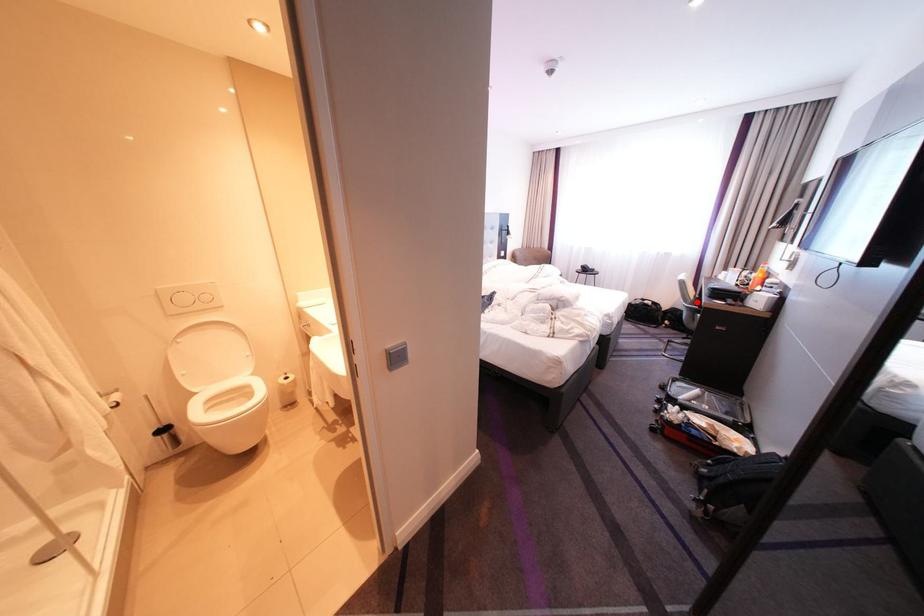
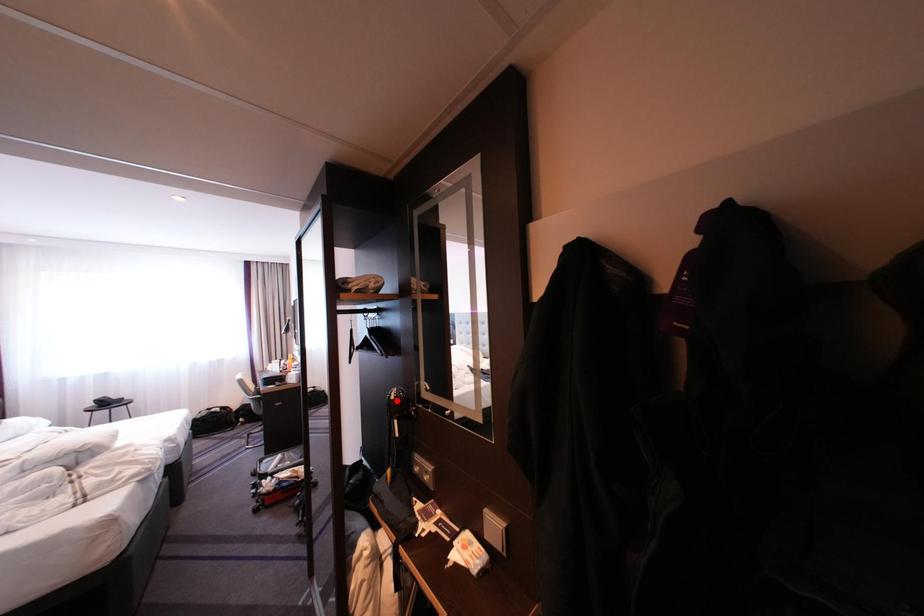
I am providing you with two images of the same scene from different viewpoints. A red point is marked on the first image and another point is marked on the second image. Is the red point in image1 aligned with the point shown in image2?

No